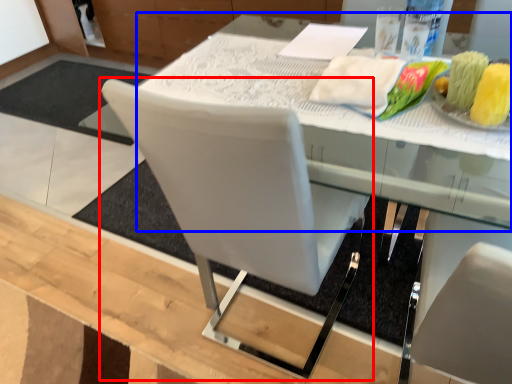
Question: Among these objects, which one is farthest to the camera, chair (highlighted by a red box) or round table (highlighted by a blue box)?

Choices:
 (A) chair
 (B) round table

Answer: (B)